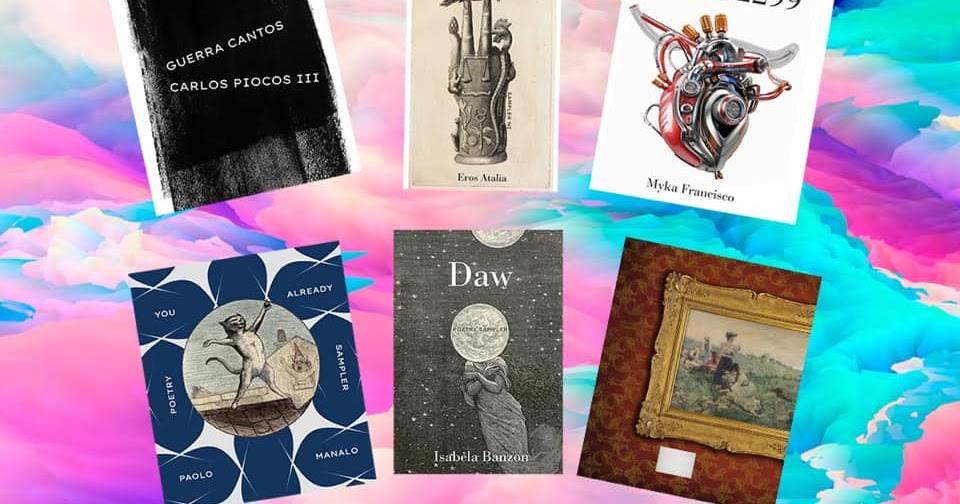
In order to click on picture in this screenshot , I will do click(x=681, y=387).